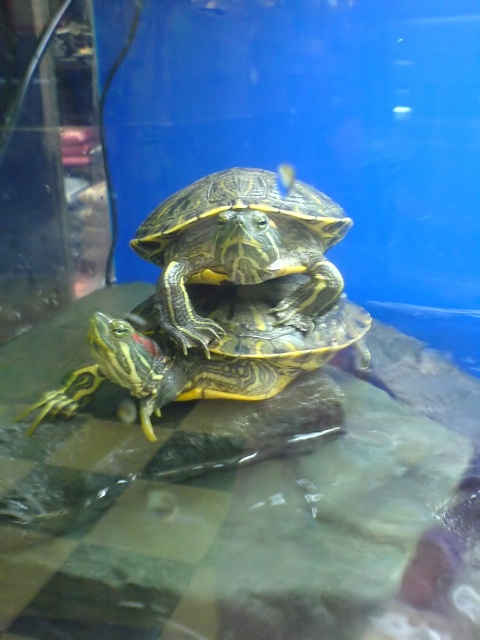
Question: Which point is closer to the camera?

Choices:
 (A) (94, 344)
 (B) (295, 250)

Answer: (A)

Question: Is shiny green shell at center positioned in front of shiny green tortoise at center?

Choices:
 (A) no
 (B) yes

Answer: (A)

Question: Does shiny green shell at center have a larger size compared to shiny green tortoise at center?

Choices:
 (A) yes
 (B) no

Answer: (B)

Question: Does shiny green shell at center appear over shiny green tortoise at center?

Choices:
 (A) yes
 (B) no

Answer: (A)

Question: Which point is closer to the camera taking this photo?

Choices:
 (A) (x=292, y=228)
 (B) (x=207, y=371)

Answer: (B)